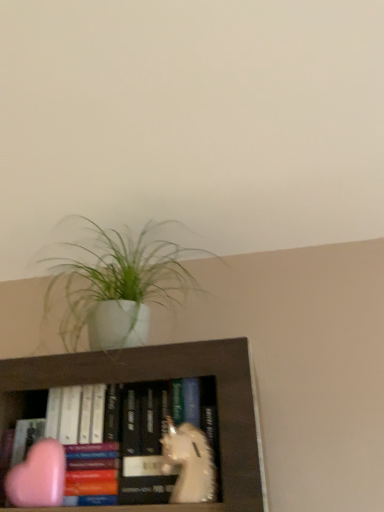
Question: Is white matte unicorn at center, placed as the 1th animal when sorted from right to left, spatially inside pink matte heart at lower left, which is the second animal from right to left, or outside of it?

Choices:
 (A) inside
 (B) outside

Answer: (B)

Question: Considering the positions of point (205, 490) and point (52, 458), is point (205, 490) closer or farther from the camera than point (52, 458)?

Choices:
 (A) closer
 (B) farther

Answer: (A)

Question: Which object is the closest to the white matte pot at upper center?

Choices:
 (A) pink matte heart at lower left, which is the second animal from right to left
 (B) white matte unicorn at center, the second animal viewed from the left

Answer: (A)

Question: Considering the real-world distances, which object is closest to the white matte pot at upper center?

Choices:
 (A) pink matte heart at lower left, which is the second animal from right to left
 (B) white matte unicorn at center, placed as the 1th animal when sorted from right to left

Answer: (A)